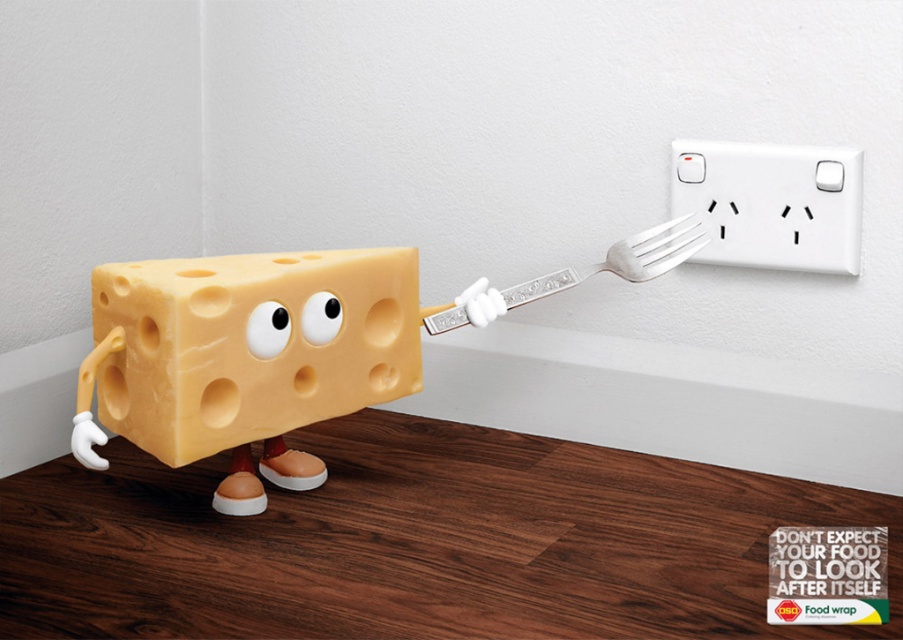
Question: Can you confirm if yellow cheese block at center is positioned to the left of white plastic socket at upper right?

Choices:
 (A) no
 (B) yes

Answer: (B)

Question: Which is farther from the yellow cheese block at center?

Choices:
 (A) white plastic socket at upper right
 (B) yellow cheese at center
 (C) silver metallic fork at upper right

Answer: (A)

Question: Based on their relative distances, which object is nearer to the yellow cheese at center?

Choices:
 (A) silver metallic fork at upper right
 (B) white plastic socket at upper right

Answer: (A)

Question: From the image, what is the correct spatial relationship of yellow cheese block at center in relation to white plastic socket at upper right?

Choices:
 (A) below
 (B) above

Answer: (A)

Question: Is white plastic socket at upper right bigger than silver metallic fork at upper right?

Choices:
 (A) no
 (B) yes

Answer: (A)

Question: Which of these objects is positioned farthest from the white plastic socket at upper right?

Choices:
 (A) yellow cheese block at center
 (B) silver metallic fork at upper right

Answer: (A)